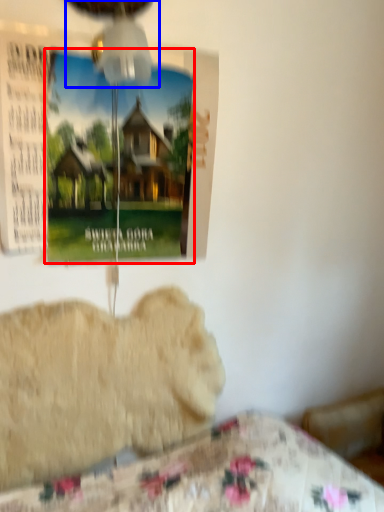
Question: Which point is closer to the camera, poster page (highlighted by a red box) or mechanical fan (highlighted by a blue box)?

Choices:
 (A) poster page
 (B) mechanical fan

Answer: (B)